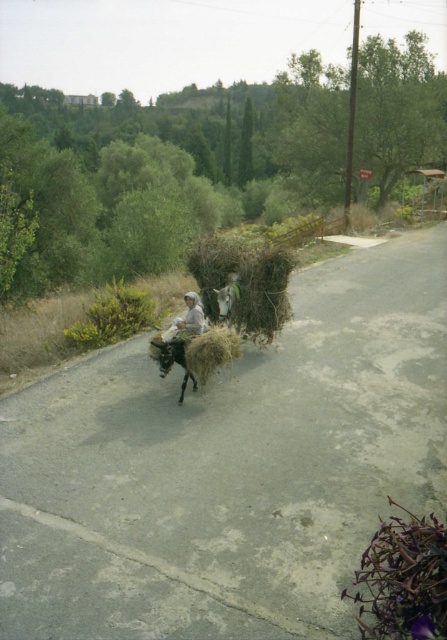
Question: Which point is farther to the camera?

Choices:
 (A) (220, 317)
 (B) (180, 348)
 (C) (178, 337)

Answer: (A)

Question: Does dark brown fuzzy donkey at center appear over brown fuzzy donkey at center?

Choices:
 (A) yes
 (B) no

Answer: (B)

Question: Which object appears farthest from the camera in this image?

Choices:
 (A) brown fuzzy donkey at center
 (B) dark brown fuzzy donkey at center

Answer: (A)

Question: Does light beige fabric at center appear over brown fuzzy donkey at center?

Choices:
 (A) yes
 (B) no

Answer: (B)

Question: Does dark brown fuzzy donkey at center come in front of brown fuzzy donkey at center?

Choices:
 (A) yes
 (B) no

Answer: (A)

Question: Estimate the real-world distances between objects in this image. Which object is farther from the brown fuzzy donkey at center?

Choices:
 (A) dark brown fuzzy donkey at center
 (B) light beige fabric at center

Answer: (A)